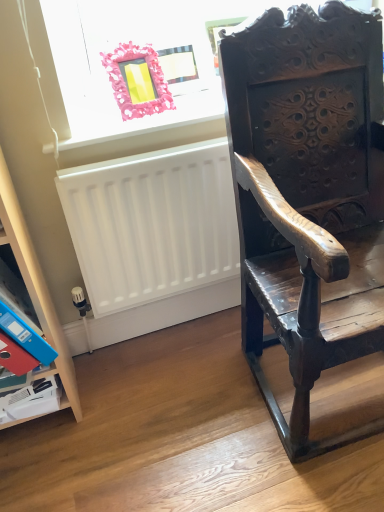
This screenshot has width=384, height=512. Identify the location of vacant area located to the right-hand side of pink fabric picture frame at upper left. (195, 98).